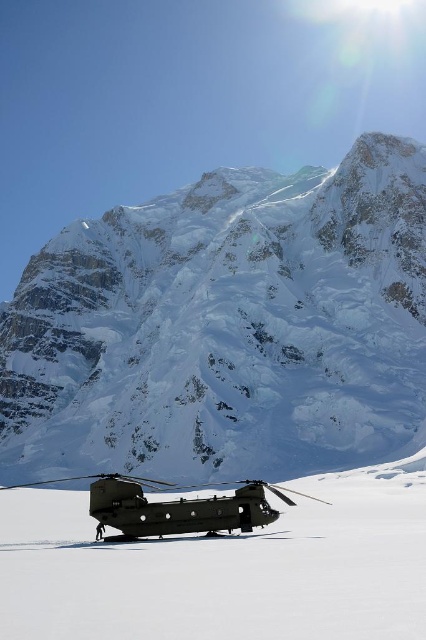
You are a pilot planning to land a helicopter on the flat snowy surface near the snowy granite mountain range at center. Based on the coordinates provided in the scene description, can you determine the direction you should approach from to ensure a safe landing?

The snowy granite mountain range at center is located at coordinates point [226,326]. To ensure a safe landing on the flat snowy surface near it, you should approach from a direction that avoids the steep and jagged terrain of the mountains, likely from a lower elevation area or a cleared path indicated by the coordinates.

You are a pilot preparing to land a matte black helicopter at lower center on the snow. There is another matte black helicopter at center already parked. Based on their sizes, which helicopter will require more space for landing?

The matte black helicopter at lower center requires more space for landing since it is larger in size compared to the matte black helicopter at center.